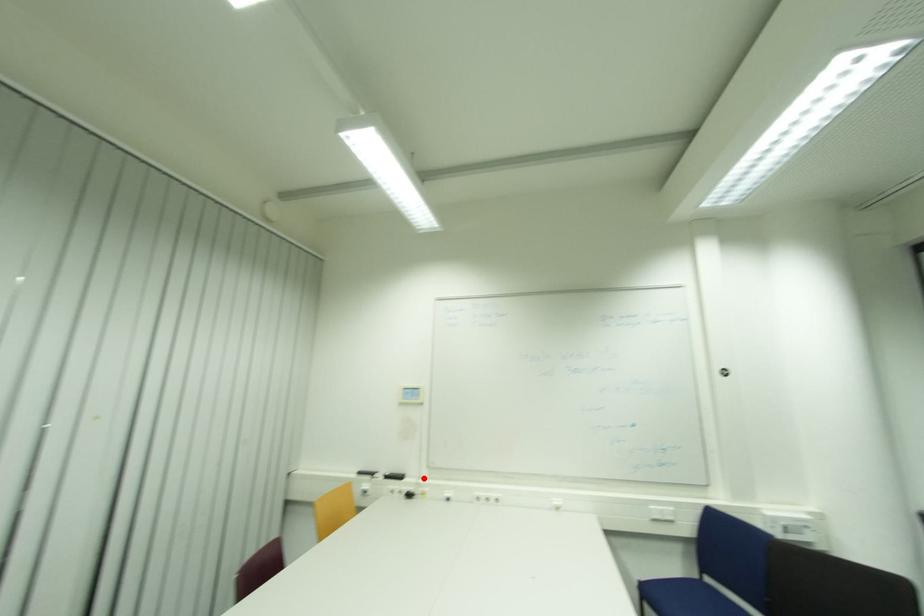
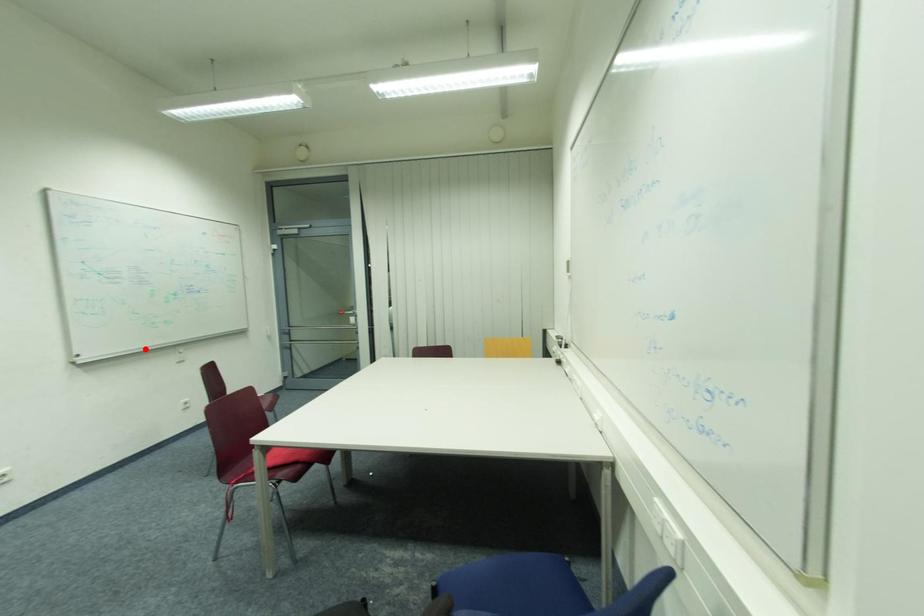
Looking at this image, I am providing you with two images of the same scene from different viewpoints. A red point is marked on the first image and another point is marked on the second image. Is the marked point in image1 the same physical position as the marked point in image2?

No